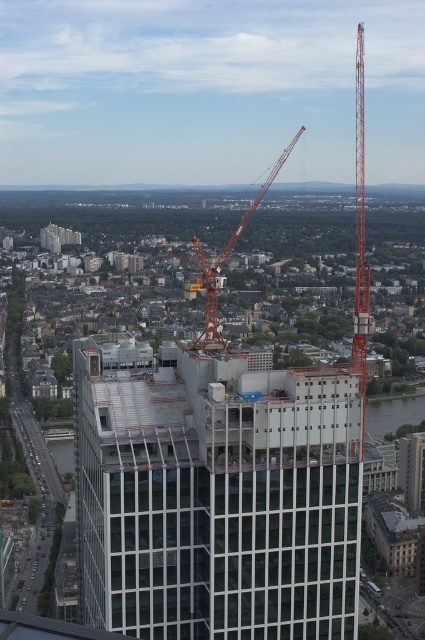
You are a drone operator trying to navigate between two points in the city. You see the point at position (87, 500) and the point at position (224, 348). Which point is closer to your current position?

Point (87, 500) is further to the viewer than point (224, 348), so the point at position (224, 348) is closer to your current position.

You are a city planner analyzing the aerial view of the city. You notice a point at coordinates (218, 499). What does this point correspond to in the city?

The point at (218, 499) corresponds to the clear glass building at center.